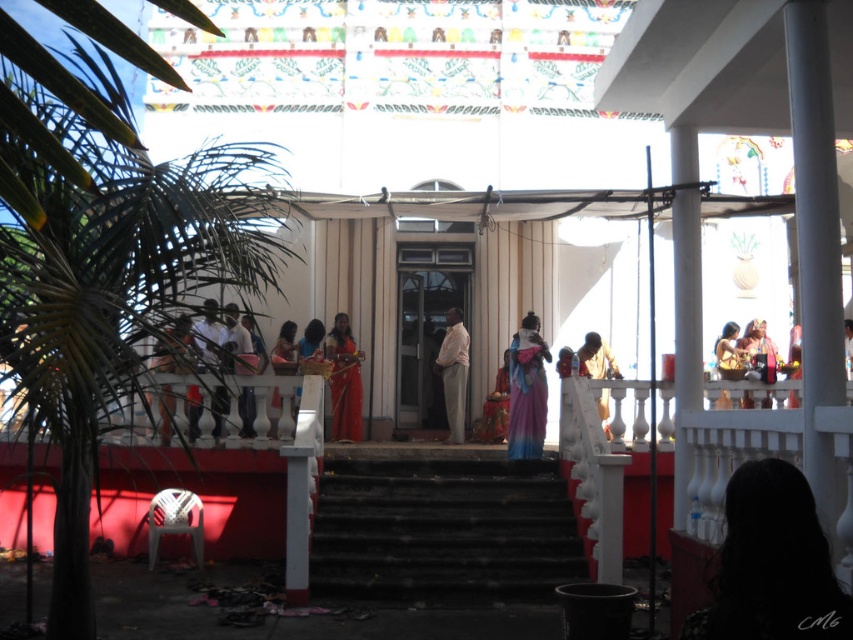
Does silky black hair at upper right appear under matte black dress at center?

Yes, silky black hair at upper right is below matte black dress at center.

At what (x,y) coordinates should I click in order to perform the action: click on silky black hair at upper right. Please return your answer as a coordinate pair (x, y). The height and width of the screenshot is (640, 853). Looking at the image, I should click on (770, 563).

Does point (706, 616) come farther from viewer compared to point (154, 352)?

No, it is in front of (154, 352).

The image size is (853, 640). I want to click on silky black hair at upper right, so click(x=770, y=563).

Does purple silk saree at center appear on the left side of pink fabric at center?

No, purple silk saree at center is not to the left of pink fabric at center.

Identify the location of purple silk saree at center. (527, 390).

Identify the location of purple silk saree at center. (527, 390).

Who is more distant from viewer, (527, 330) or (155, 364)?

The point (527, 330) is more distant.

Does purple silk saree at center come in front of matte black dress at center?

No, it is not.

Does point (531, 364) come farther from viewer compared to point (193, 355)?

Yes, point (531, 364) is behind point (193, 355).

The image size is (853, 640). What are the coordinates of `purple silk saree at center` in the screenshot? It's located at (527, 390).